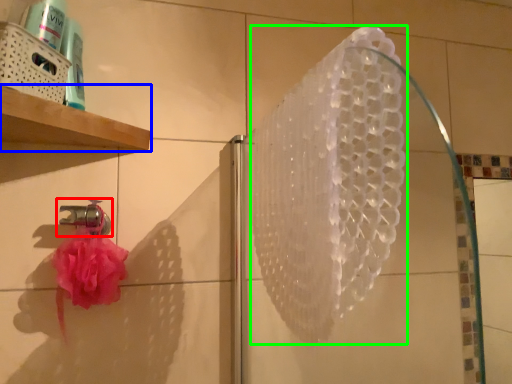
Question: Estimate the real-world distances between objects in this image. Which object is farther from tap (highlighted by a red box), shelf (highlighted by a blue box) or shower (highlighted by a green box)?

Choices:
 (A) shelf
 (B) shower

Answer: (B)